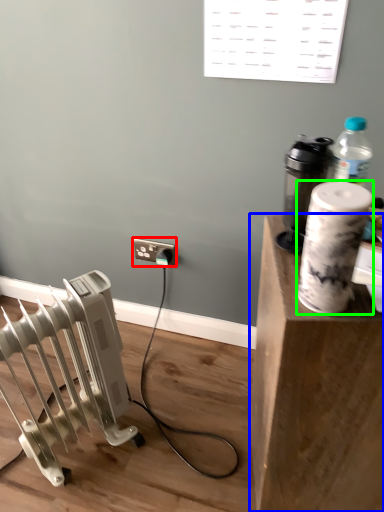
Question: Considering the real-world distances, which object is farthest from electric outlet (highlighted by a red box)? furniture (highlighted by a blue box) or paper towel (highlighted by a green box)?

Choices:
 (A) furniture
 (B) paper towel

Answer: (B)